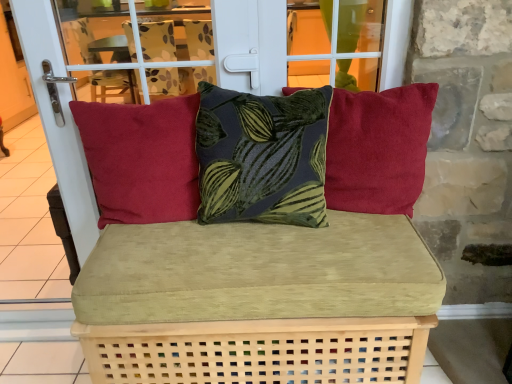
Question: Would you say matte red cushion at left, acting as the third pillow starting from the right, is to the left or to the right of velvet green leaf-patterned pillow at center, the 2th pillow in the left-to-right sequence, in the picture?

Choices:
 (A) left
 (B) right

Answer: (A)

Question: Considering the positions of point (112, 188) and point (223, 153), is point (112, 188) closer or farther from the camera than point (223, 153)?

Choices:
 (A) closer
 (B) farther

Answer: (B)

Question: Which of these objects is positioned farthest from the matte red cushion at right, the third pillow when ordered from left to right?

Choices:
 (A) velvet green cushion at center
 (B) velvet green leaf-patterned pillow at center, the 2th pillow in the left-to-right sequence
 (C) matte red cushion at left, positioned as the 1th pillow in left-to-right order

Answer: (C)

Question: Which is nearer to the velvet green cushion at center?

Choices:
 (A) velvet green leaf-patterned pillow at center, the second pillow in the right-to-left sequence
 (B) matte red cushion at right, the third pillow when ordered from left to right
 (C) matte red cushion at left, positioned as the 1th pillow in left-to-right order

Answer: (A)